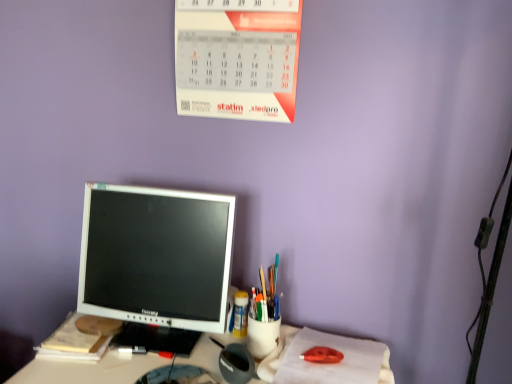
Question: Is translucent plastic cup at center, positioned as the first stationery in left-to-right order, looking in the opposite direction of matte plastic cup at center, placed as the 1th stationery when sorted from right to left?

Choices:
 (A) yes
 (B) no

Answer: (B)

Question: Is translucent plastic cup at center, positioned as the first stationery in left-to-right order, far from matte plastic cup at center, which is the 2th stationery from left to right?

Choices:
 (A) yes
 (B) no

Answer: (B)

Question: Is translucent plastic cup at center, which ranks as the 2th stationery in front-to-back order, positioned behind matte plastic cup at center, the first stationery from the front?

Choices:
 (A) no
 (B) yes

Answer: (B)

Question: Is translucent plastic cup at center, which ranks as the first stationery in back-to-front order, not within matte plastic cup at center, placed as the 1th stationery when sorted from right to left?

Choices:
 (A) no
 (B) yes

Answer: (B)

Question: Can you confirm if translucent plastic cup at center, positioned as the first stationery in left-to-right order, is positioned to the right of matte plastic cup at center, placed as the 1th stationery when sorted from right to left?

Choices:
 (A) no
 (B) yes

Answer: (A)

Question: Can you confirm if translucent plastic cup at center, arranged as the 2th stationery when viewed from the right, is shorter than matte plastic cup at center, which ranks as the second stationery in back-to-front order?

Choices:
 (A) no
 (B) yes

Answer: (B)

Question: Could translucent plastic cup at center, which ranks as the 2th stationery in front-to-back order, be considered to be inside white glossy monitor at center?

Choices:
 (A) no
 (B) yes

Answer: (A)

Question: Can you confirm if white glossy monitor at center is shorter than translucent plastic cup at center, which ranks as the first stationery in back-to-front order?

Choices:
 (A) yes
 (B) no

Answer: (B)

Question: Is white glossy monitor at center thinner than translucent plastic cup at center, which ranks as the first stationery in back-to-front order?

Choices:
 (A) no
 (B) yes

Answer: (A)

Question: From a real-world perspective, is white glossy monitor at center on translucent plastic cup at center, arranged as the 2th stationery when viewed from the right?

Choices:
 (A) yes
 (B) no

Answer: (B)

Question: Can you confirm if white glossy monitor at center is taller than translucent plastic cup at center, which ranks as the first stationery in back-to-front order?

Choices:
 (A) no
 (B) yes

Answer: (B)

Question: Does white glossy monitor at center touch translucent plastic cup at center, positioned as the first stationery in left-to-right order?

Choices:
 (A) no
 (B) yes

Answer: (A)

Question: Does red paper calendar at upper center have a lesser width compared to yellow paper notebook at lower left?

Choices:
 (A) no
 (B) yes

Answer: (B)